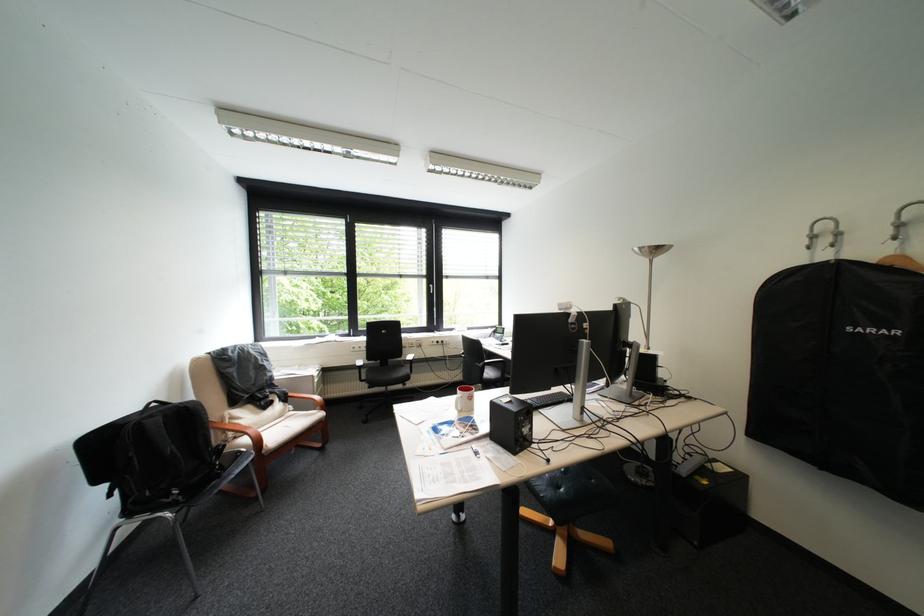
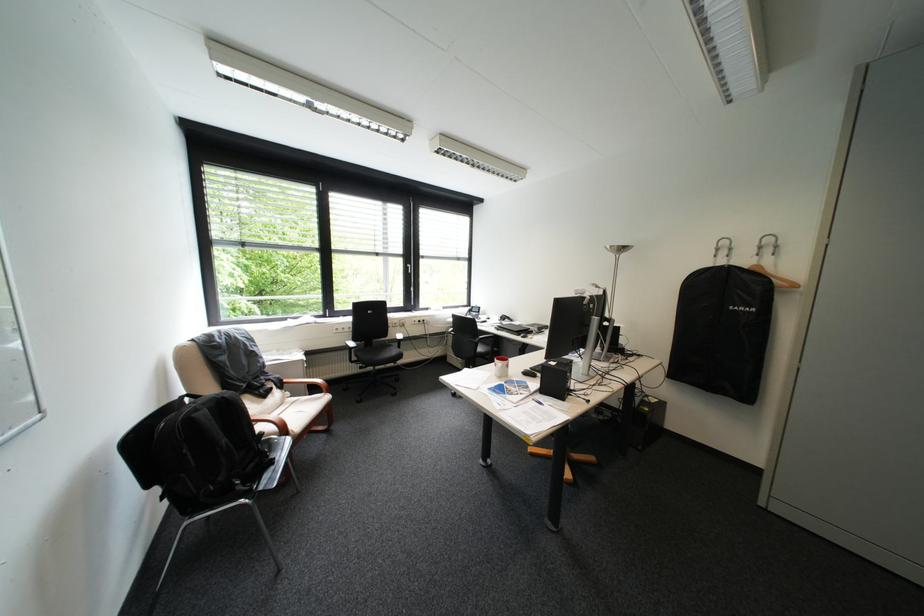
In the second image, find the point that corresponds to (x=270, y=415) in the first image.

(272, 403)